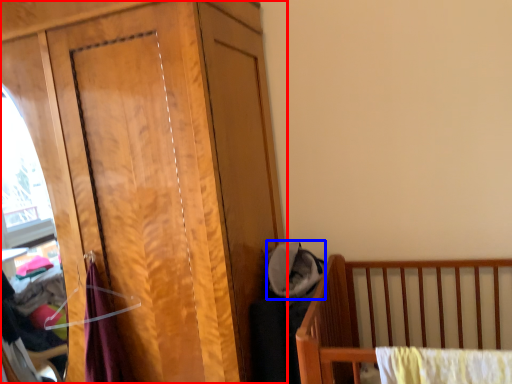
Question: Among these objects, which one is nearest to the camera, dresser (highlighted by a red box) or baby clothe (highlighted by a blue box)?

Choices:
 (A) dresser
 (B) baby clothe

Answer: (A)